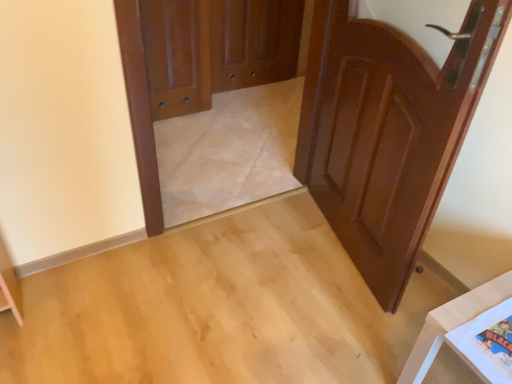
Question: Is brown wooden screen door at center not near polished wood door at upper left, the 2th door from the right?

Choices:
 (A) no
 (B) yes

Answer: (A)

Question: Is brown wooden screen door at center bigger than polished wood door at upper left, which is the first door from left to right?

Choices:
 (A) yes
 (B) no

Answer: (B)

Question: Is the surface of brown wooden screen door at center in direct contact with polished wood door at upper left, the 2th door from the right?

Choices:
 (A) yes
 (B) no

Answer: (B)

Question: Can you confirm if brown wooden screen door at center is shorter than polished wood door at upper left, which is the first door from left to right?

Choices:
 (A) no
 (B) yes

Answer: (B)

Question: Is brown wooden screen door at center wider than polished wood door at upper left, which is counted as the first door, starting from the back?

Choices:
 (A) no
 (B) yes

Answer: (A)

Question: From the image's perspective, is brown wooden screen door at center on polished wood door at upper left, which is counted as the first door, starting from the back?

Choices:
 (A) yes
 (B) no

Answer: (A)

Question: From the image's perspective, is polished wood door at upper left, placed as the second door when sorted from front to back, beneath brown wooden screen door at center?

Choices:
 (A) yes
 (B) no

Answer: (A)

Question: Is polished wood door at upper left, which is counted as the first door, starting from the back, facing towards brown wooden screen door at center?

Choices:
 (A) no
 (B) yes

Answer: (A)

Question: Is polished wood door at upper left, placed as the second door when sorted from front to back, looking in the opposite direction of brown wooden screen door at center?

Choices:
 (A) no
 (B) yes

Answer: (A)

Question: Can you confirm if polished wood door at upper left, which is the first door from left to right, is shorter than brown wooden screen door at center?

Choices:
 (A) yes
 (B) no

Answer: (B)

Question: Is polished wood door at upper left, placed as the second door when sorted from front to back, far away from brown wooden screen door at center?

Choices:
 (A) no
 (B) yes

Answer: (A)

Question: Can you confirm if polished wood door at upper left, the 2th door from the right, is wider than brown wooden screen door at center?

Choices:
 (A) no
 (B) yes

Answer: (B)

Question: Would you say brown wooden screen door at center is outside white glossy table at lower right?

Choices:
 (A) no
 (B) yes

Answer: (B)